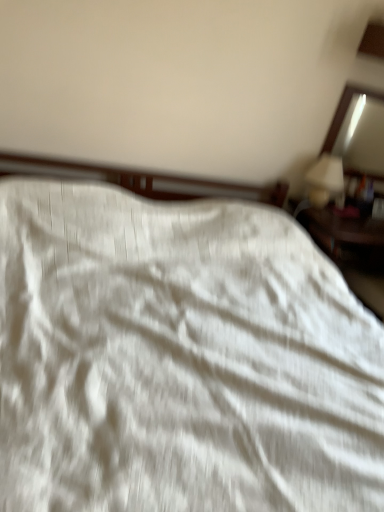
Question: Considering their positions, is white glossy table lamp at upper right located in front of or behind white textured fabric at center?

Choices:
 (A) front
 (B) behind

Answer: (B)

Question: Which is correct: white glossy table lamp at upper right is inside white textured fabric at center, or outside of it?

Choices:
 (A) inside
 (B) outside

Answer: (B)

Question: Which object is the closest to the matte wooden mirror at upper right?

Choices:
 (A) white textured fabric at center
 (B) white glossy table lamp at upper right

Answer: (B)

Question: Which object is positioned farthest from the matte wooden mirror at upper right?

Choices:
 (A) white textured fabric at center
 (B) white glossy table lamp at upper right

Answer: (A)